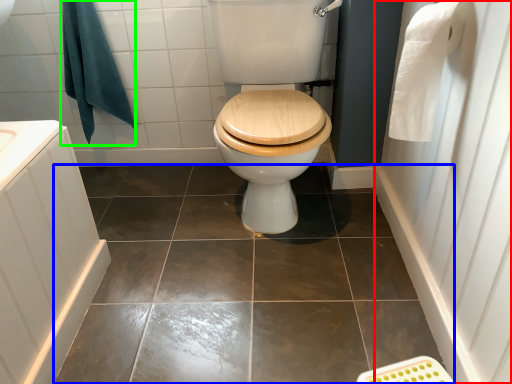
Question: Based on their relative distances, which object is farther from side (highlighted by a red box)? Choose from ceramic tile (highlighted by a blue box) and bath towel (highlighted by a green box).

Choices:
 (A) ceramic tile
 (B) bath towel

Answer: (B)